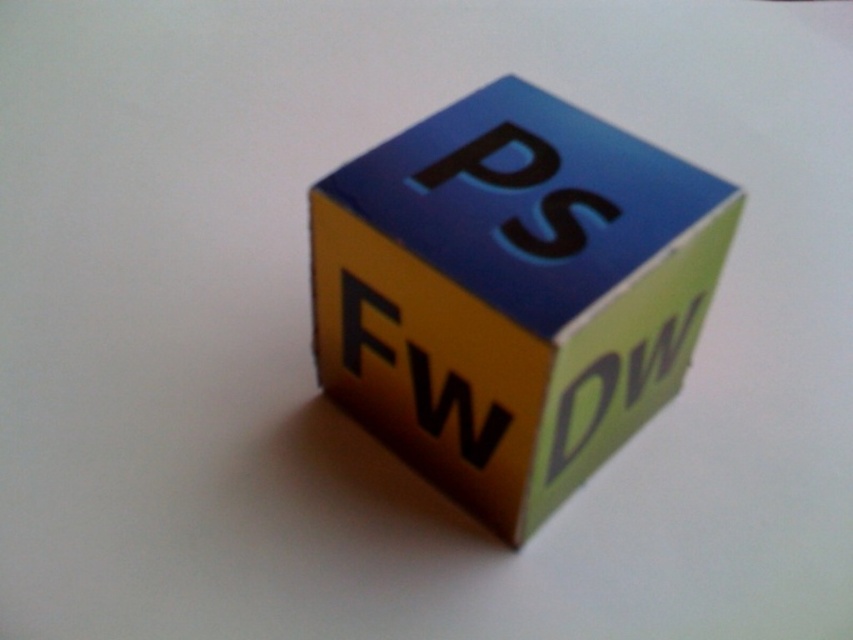
You are an Adobe software expert examining the cube. You see the point coordinates at point [494,161]. Which Adobe software label is located at that point?

The blue matte letter at upper center at point [494,161] corresponds to Adobe Photoshop, as the top face of the cube is blue with the letters

What is the position of the black matte letter w at center relative to the other faces of the cube?

The black matte letter w at center is located at point coordinates of (x=456, y=410) on the cube.